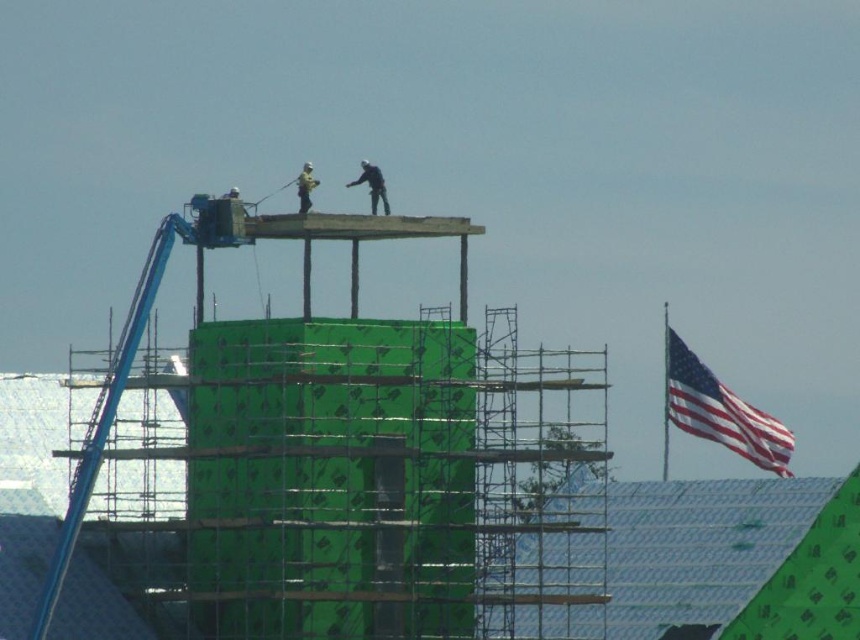
Who is shorter, dark blue jeans at center or light brown wood construction worker at upper center?

With less height is light brown wood construction worker at upper center.

Does dark blue jeans at center appear over light brown wood construction worker at upper center?

No, dark blue jeans at center is not above light brown wood construction worker at upper center.

I want to click on dark blue jeans at center, so click(x=372, y=186).

Is point (699, 381) behind point (384, 189)?

Yes, it is.

Can you confirm if american flag at right is wider than dark blue jeans at center?

Indeed, american flag at right has a greater width compared to dark blue jeans at center.

This screenshot has width=860, height=640. What do you see at coordinates (720, 412) in the screenshot?
I see `american flag at right` at bounding box center [720, 412].

The image size is (860, 640). In order to click on american flag at right in this screenshot , I will do tap(720, 412).

Describe the element at coordinates (720, 412) in the screenshot. The width and height of the screenshot is (860, 640). I see `american flag at right` at that location.

Can you confirm if american flag at right is bigger than light brown wood construction worker at upper center?

Yes, american flag at right is bigger than light brown wood construction worker at upper center.

At what (x,y) coordinates should I click in order to perform the action: click on american flag at right. Please return your answer as a coordinate pair (x, y). Image resolution: width=860 pixels, height=640 pixels. Looking at the image, I should click on (720, 412).